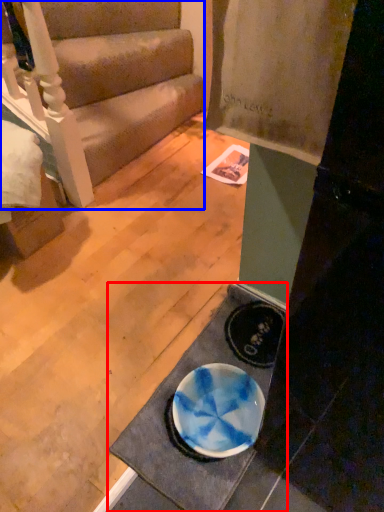
Question: Which object is closer to the camera taking this photo, doormat (highlighted by a red box) or studio couch (highlighted by a blue box)?

Choices:
 (A) doormat
 (B) studio couch

Answer: (A)